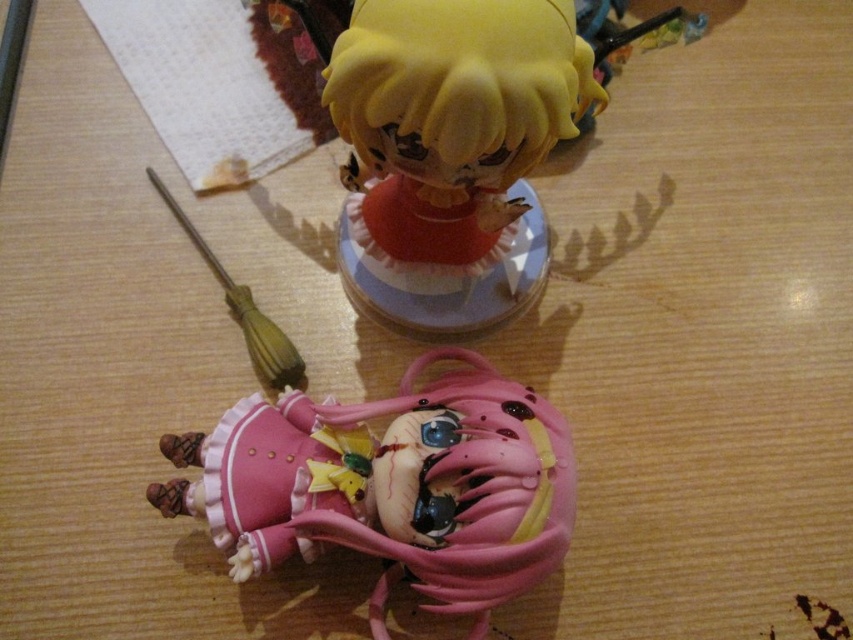
Based on the photo, you are setting up a display for a miniature collection. You have two items to place on a shelf that can only accommodate items up to 10 cm in height. The pink matte doll at lower center and the yellow matte figurine at upper center are both candidates. Given their sizes, which one is more likely to fit within the height restriction?

The pink matte doll at lower center has a smaller size compared to the yellow matte figurine at upper center, so it is more likely to fit within the 10 cm height restriction.

You are an artist setting up a display for an art exhibition. You have two figurines to place on a shelf. The pink matte doll at lower center and the yellow matte figurine at upper center. Based on their sizes, which figurine should you place on the lower shelf to ensure it doesn

The pink matte doll at lower center is taller than the yellow matte figurine at upper center. Therefore, the pink matte doll at lower center should be placed on the lower shelf to accommodate its height, while the smaller yellow matte figurine at upper center can be placed on the upper shelf for balance.